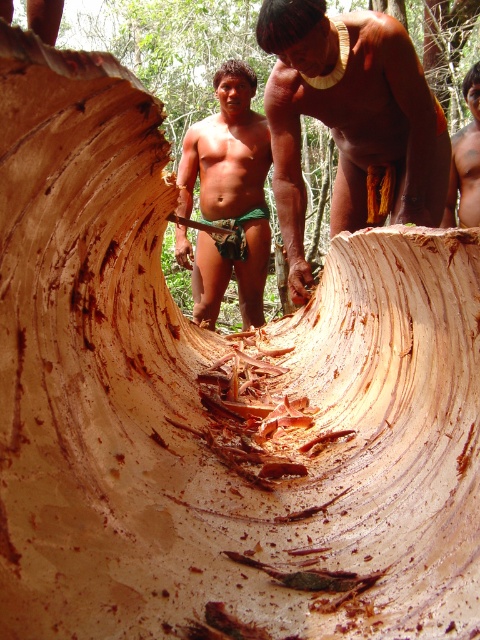
Is smooth brown wood at center in front of matte green shorts at center?

Yes, it is in front of matte green shorts at center.

Is the position of smooth brown wood at center more distant than that of matte green shorts at center?

No, smooth brown wood at center is closer to the viewer.

This screenshot has height=640, width=480. Identify the location of smooth brown wood at center. (350, 120).

Can you confirm if matte green shorts at center is positioned to the left of brown textured skin at upper center?

Yes, matte green shorts at center is to the left of brown textured skin at upper center.

Is matte green shorts at center closer to the viewer compared to brown textured skin at upper center?

No, matte green shorts at center is behind brown textured skin at upper center.

Between point (216, 316) and point (471, 97), which one is positioned in front?

Point (471, 97) is more forward.

Identify the location of matte green shorts at center. Image resolution: width=480 pixels, height=640 pixels. coord(228,195).

Can you confirm if smooth brown wood at center is positioned to the right of brown textured skin at upper center?

Incorrect, smooth brown wood at center is not on the right side of brown textured skin at upper center.

Who is taller, smooth brown wood at center or brown textured skin at upper center?

brown textured skin at upper center is taller.

Identify the location of smooth brown wood at center. Image resolution: width=480 pixels, height=640 pixels. (350, 120).